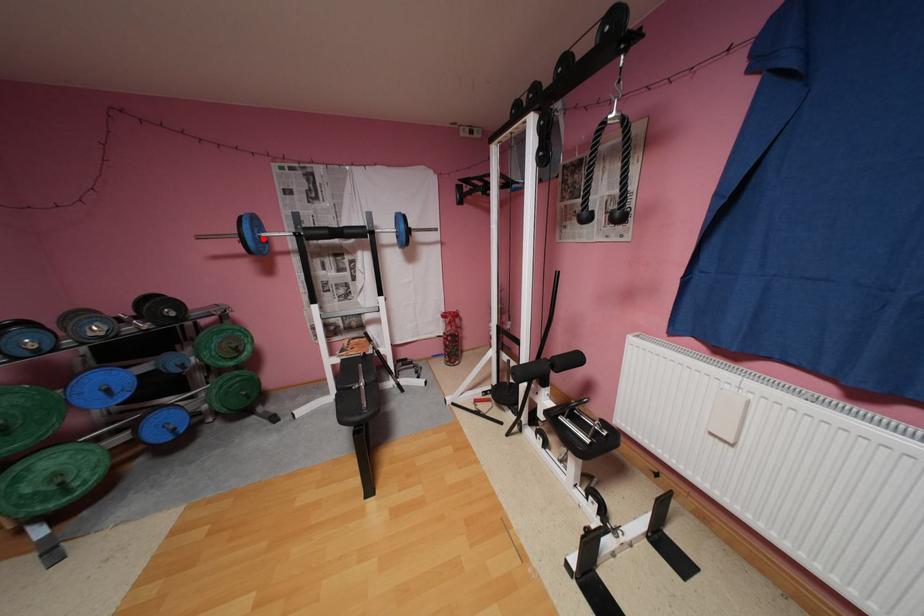
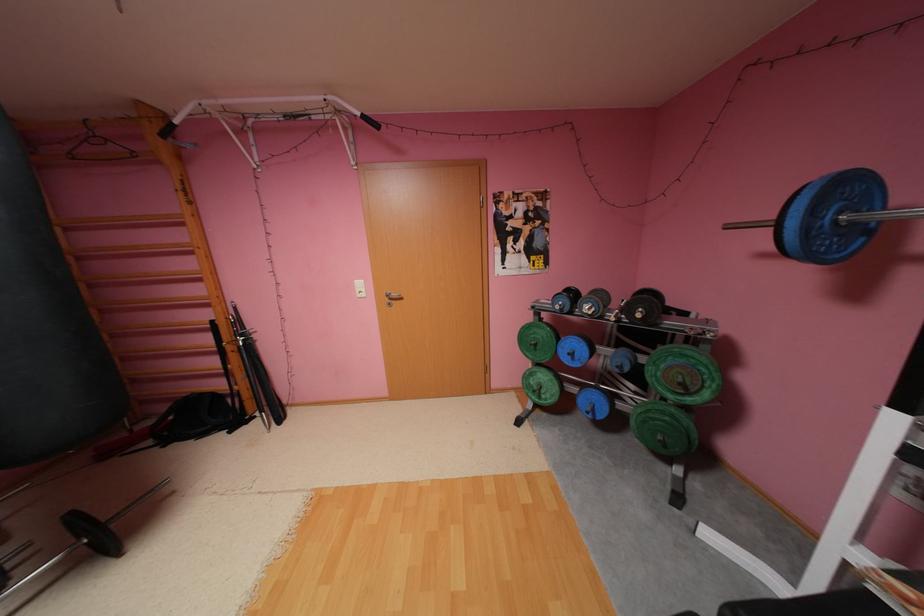
Where in the second image is the point corresponding to the highlighted location from the first image?

(816, 229)